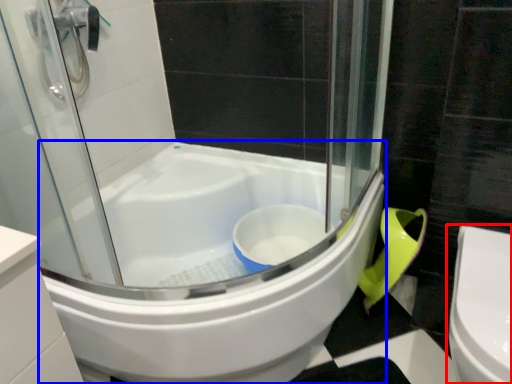
Question: Among these objects, which one is nearest to the camera, toilet (highlighted by a red box) or bathtub (highlighted by a blue box)?

Choices:
 (A) toilet
 (B) bathtub

Answer: (A)